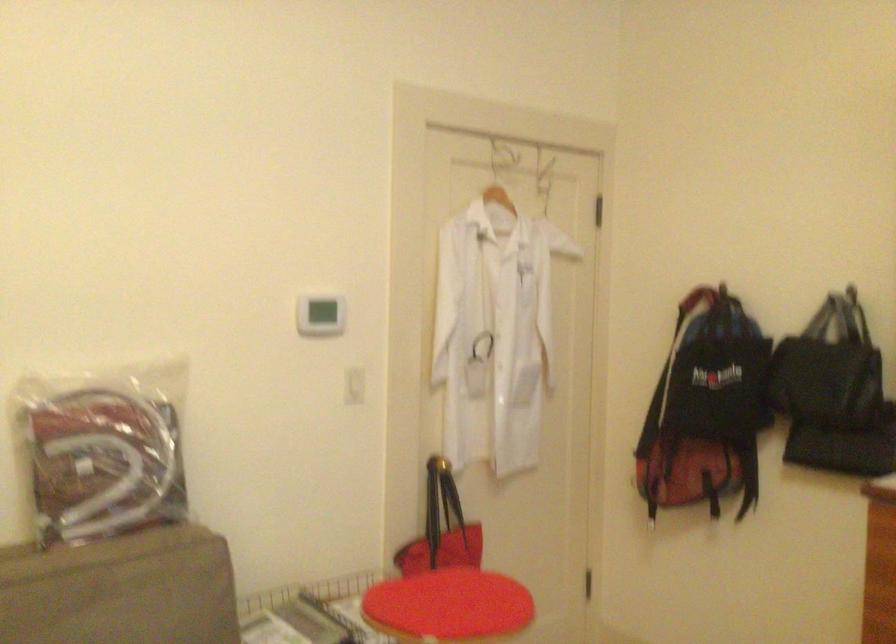
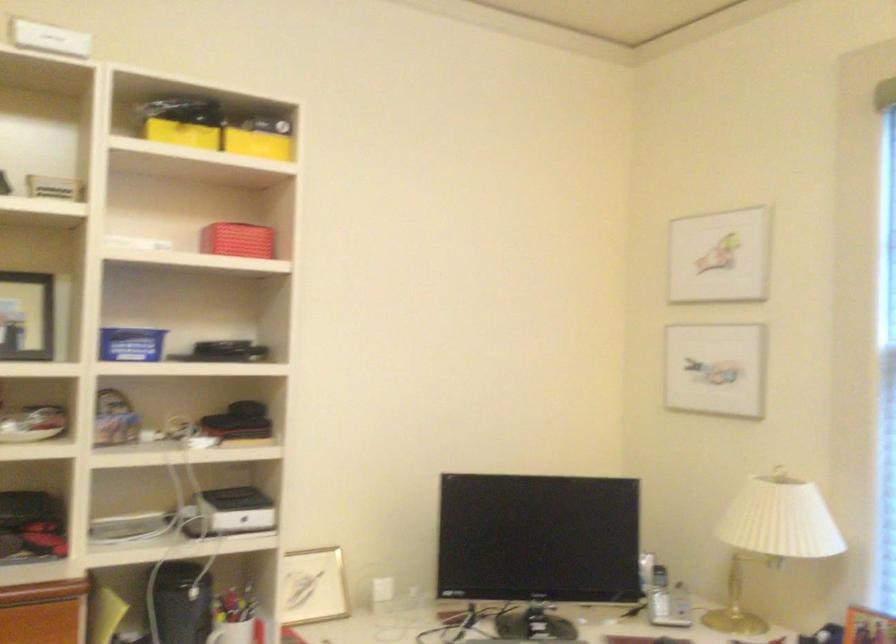
Question: The camera is either moving clockwise (left) or counter-clockwise (right) around the object. The first image is from the beginning of the video and the second image is from the end. Is the camera moving left or right when shooting the video?

Choices:
 (A) Left
 (B) Right

Answer: (A)